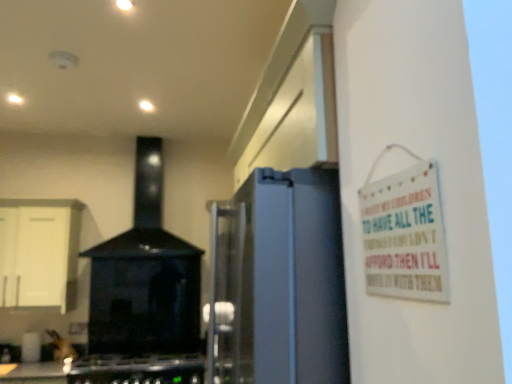
At what (x,y) coordinates should I click in order to perform the action: click on white wooden sign at upper right. Please return your answer as a coordinate pair (x, y). The image size is (512, 384). Looking at the image, I should click on (405, 235).

Describe the element at coordinates (145, 277) in the screenshot. Image resolution: width=512 pixels, height=384 pixels. I see `black glossy stove at center` at that location.

The height and width of the screenshot is (384, 512). What do you see at coordinates (39, 252) in the screenshot? I see `white matte cabinet at left` at bounding box center [39, 252].

The height and width of the screenshot is (384, 512). I want to click on black matte gas stove at lower left, so click(137, 370).

From the image's perspective, would you say black glossy stove at center is shown under white wooden sign at upper right?

Actually, black glossy stove at center appears above white wooden sign at upper right in the image.

Is black glossy stove at center closer to the viewer compared to white wooden sign at upper right?

No, it is behind white wooden sign at upper right.

Considering the relative positions of black glossy stove at center and white wooden sign at upper right in the image provided, is black glossy stove at center to the left of white wooden sign at upper right from the viewer's perspective?

Correct, you'll find black glossy stove at center to the left of white wooden sign at upper right.

Is black glossy stove at center looking in the opposite direction of white wooden sign at upper right?

No, white wooden sign at upper right is not at the back of black glossy stove at center.

In terms of size, does white wooden sign at upper right appear bigger or smaller than black glossy stove at center?

In the image, white wooden sign at upper right appears to be smaller than black glossy stove at center.

Is black glossy stove at center located within white wooden sign at upper right?

No, black glossy stove at center is not surrounded by white wooden sign at upper right.

From the image's perspective, relative to black glossy stove at center, is white wooden sign at upper right above or below?

Based on their image positions, white wooden sign at upper right is located beneath black glossy stove at center.

Is white matte cabinet at left bigger than black glossy stove at center?

No, white matte cabinet at left is not bigger than black glossy stove at center.

Is white matte cabinet at left shorter than black glossy stove at center?

Yes, white matte cabinet at left is shorter than black glossy stove at center.

Which object is wider, white matte cabinet at left or black glossy stove at center?

Wider between the two is black glossy stove at center.

Where is `cabinetry in front of the black glossy stove at center`? cabinetry in front of the black glossy stove at center is located at coordinates (39, 252).

How much distance is there between black matte gas stove at lower left and white wooden sign at upper right?

8.57 feet.

Between black matte gas stove at lower left and white wooden sign at upper right, which one has more height?

With more height is white wooden sign at upper right.

From the picture: Which object is closer to the camera taking this photo, black matte gas stove at lower left or white wooden sign at upper right?

white wooden sign at upper right is more forward.

From the image's perspective, would you say black matte gas stove at lower left is shown under white wooden sign at upper right?

Yes, from the image's perspective, black matte gas stove at lower left is below white wooden sign at upper right.

Is black matte gas stove at lower left placed right next to black glossy stove at center?

No, black matte gas stove at lower left is not touching black glossy stove at center.

Considering the positions of objects black matte gas stove at lower left and black glossy stove at center in the image provided, who is more to the left, black matte gas stove at lower left or black glossy stove at center?

From the viewer's perspective, black glossy stove at center appears more on the left side.

Can you confirm if black matte gas stove at lower left is shorter than black glossy stove at center?

Yes, black matte gas stove at lower left is shorter than black glossy stove at center.

Can you confirm if black matte gas stove at lower left is bigger than black glossy stove at center?

No, black matte gas stove at lower left is not bigger than black glossy stove at center.

Is white matte cabinet at left located outside black matte gas stove at lower left?

That's correct, white matte cabinet at left is outside of black matte gas stove at lower left.

From a real-world perspective, who is located lower, white matte cabinet at left or black matte gas stove at lower left?

In real-world perspective, black matte gas stove at lower left is lower.

Considering the sizes of objects white matte cabinet at left and black matte gas stove at lower left in the image provided, who is bigger, white matte cabinet at left or black matte gas stove at lower left?

white matte cabinet at left.

Between white matte cabinet at left and black matte gas stove at lower left, which one is positioned behind?

white matte cabinet at left is behind.

Between black glossy stove at center and black matte gas stove at lower left, which one has less height?

With less height is black matte gas stove at lower left.

How far apart are black glossy stove at center and black matte gas stove at lower left?

They are 22.67 inches apart.

Considering the sizes of black glossy stove at center and black matte gas stove at lower left in the image, is black glossy stove at center bigger or smaller than black matte gas stove at lower left?

Clearly, black glossy stove at center is larger in size than black matte gas stove at lower left.

In terms of width, does black glossy stove at center look wider or thinner when compared to black matte gas stove at lower left?

black glossy stove at center is thinner than black matte gas stove at lower left.

This screenshot has width=512, height=384. Find the location of `warning sign located underneath the black glossy stove at center (from a real-world perspective)`. warning sign located underneath the black glossy stove at center (from a real-world perspective) is located at coordinates (405, 235).

Find the location of a particular element. This screenshot has width=512, height=384. home appliance that appears above the white wooden sign at upper right (from the image's perspective) is located at coordinates (145, 277).

Looking at the image, which one is located further to black matte gas stove at lower left, white matte cabinet at left or black glossy stove at center?

white matte cabinet at left is further to black matte gas stove at lower left.

Looking at the image, which one is located further to black glossy stove at center, white wooden sign at upper right or black matte gas stove at lower left?

white wooden sign at upper right.

Considering their positions, is black matte gas stove at lower left positioned further to white wooden sign at upper right than black glossy stove at center?

black glossy stove at center is positioned further to the anchor white wooden sign at upper right.

Based on their spatial positions, is white matte cabinet at left or black glossy stove at center closer to white wooden sign at upper right?

white matte cabinet at left lies closer to white wooden sign at upper right than the other object.

When comparing their distances from black glossy stove at center, does white matte cabinet at left or black matte gas stove at lower left seem further?

Among the two, black matte gas stove at lower left is located further to black glossy stove at center.

Which object lies further to the anchor point black matte gas stove at lower left, black glossy stove at center or white matte cabinet at left?

white matte cabinet at left.

From the image, which object appears to be farther from white wooden sign at upper right, white matte cabinet at left or black matte gas stove at lower left?

white matte cabinet at left lies further to white wooden sign at upper right than the other object.

Based on their spatial positions, is black matte gas stove at lower left or white matte cabinet at left closer to black glossy stove at center?

Based on the image, white matte cabinet at left appears to be nearer to black glossy stove at center.

This screenshot has height=384, width=512. I want to click on gas stove between white wooden sign at upper right and black glossy stove at center along the z-axis, so click(x=137, y=370).

Find the location of `gas stove between white wooden sign at upper right and white matte cabinet at left from front to back`. gas stove between white wooden sign at upper right and white matte cabinet at left from front to back is located at coordinates (137, 370).

Image resolution: width=512 pixels, height=384 pixels. Find the location of `cabinetry between black glossy stove at center and black matte gas stove at lower left in the vertical direction`. cabinetry between black glossy stove at center and black matte gas stove at lower left in the vertical direction is located at coordinates (39, 252).

This screenshot has width=512, height=384. I want to click on cabinetry positioned between white wooden sign at upper right and black glossy stove at center from near to far, so click(39, 252).